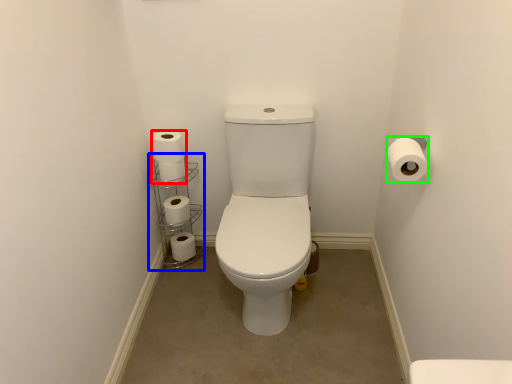
Question: Which object is positioned closest to toilet paper (highlighted by a red box)? Select from shelf (highlighted by a blue box) and toilet paper (highlighted by a green box).

Choices:
 (A) shelf
 (B) toilet paper

Answer: (A)